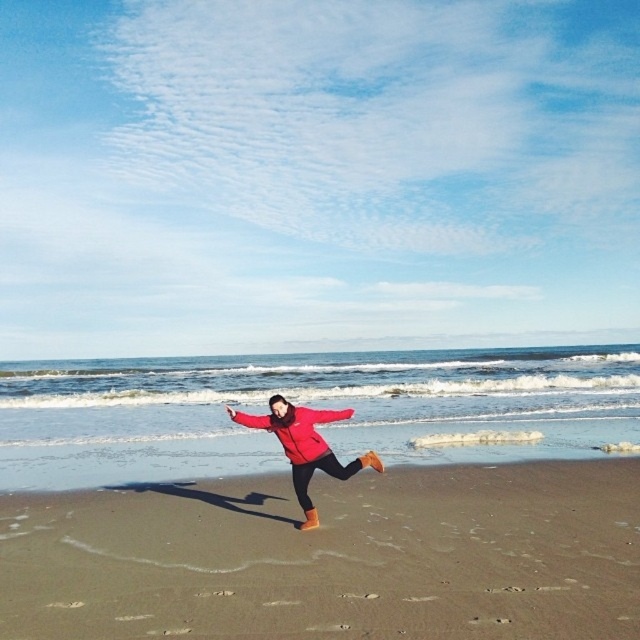
Question: Can you confirm if brown sandy beach at center is wider than matte red jacket at center?

Choices:
 (A) no
 (B) yes

Answer: (A)

Question: Is brown sandy beach at center wider than matte red jacket at center?

Choices:
 (A) no
 (B) yes

Answer: (A)

Question: Which of the following is the closest to the observer?

Choices:
 (A) (301, 474)
 (B) (74, 573)

Answer: (B)

Question: Which point is closer to the camera?

Choices:
 (A) (392, 577)
 (B) (340, 468)

Answer: (A)

Question: Can you confirm if brown sandy beach at center is positioned to the right of matte red jacket at center?

Choices:
 (A) no
 (B) yes

Answer: (B)